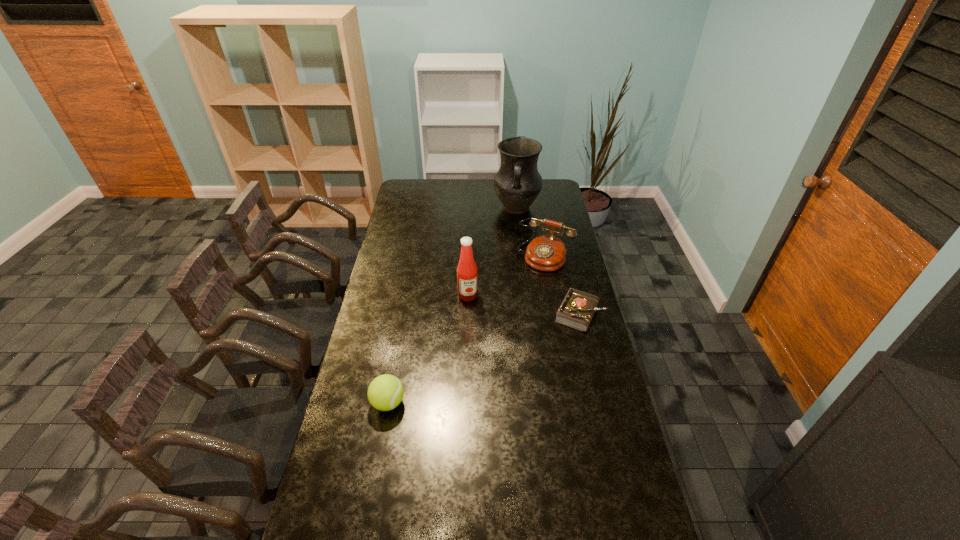
Where is `vacant space at the far left corner of the desktop`? This screenshot has width=960, height=540. vacant space at the far left corner of the desktop is located at coordinates 415,181.

Locate an element on the screen. The height and width of the screenshot is (540, 960). free space at the near left corner of the desktop is located at coordinates (323, 516).

Locate an element on the screen. This screenshot has height=540, width=960. free space between the telephone and the diary is located at coordinates (563, 285).

The width and height of the screenshot is (960, 540). In order to click on empty space between the fourth object from right to left and the nearest object in this screenshot , I will do `click(428, 349)`.

The height and width of the screenshot is (540, 960). Find the location of `unoccupied area between the second farthest object and the diary`. unoccupied area between the second farthest object and the diary is located at coordinates (563, 285).

The image size is (960, 540). I want to click on free spot between the fourth object from right to left and the pitcher, so click(x=492, y=252).

Locate an element on the screen. This screenshot has height=540, width=960. blank region between the third tallest object and the diary is located at coordinates (563, 285).

Identify the location of free space between the diary and the leftmost object. (484, 359).

You are a GUI agent. You are given a task and a screenshot of the screen. Output one action in this format:
    pyautogui.click(x=<x>, y=<y>)
    Task: Click on the vacant space that is in between the farthest object and the telephone
    The image size is (960, 540).
    Given the screenshot: What is the action you would take?
    pyautogui.click(x=531, y=232)

Locate an element on the screen. The image size is (960, 540). empty location between the diary and the second farthest object is located at coordinates (563, 285).